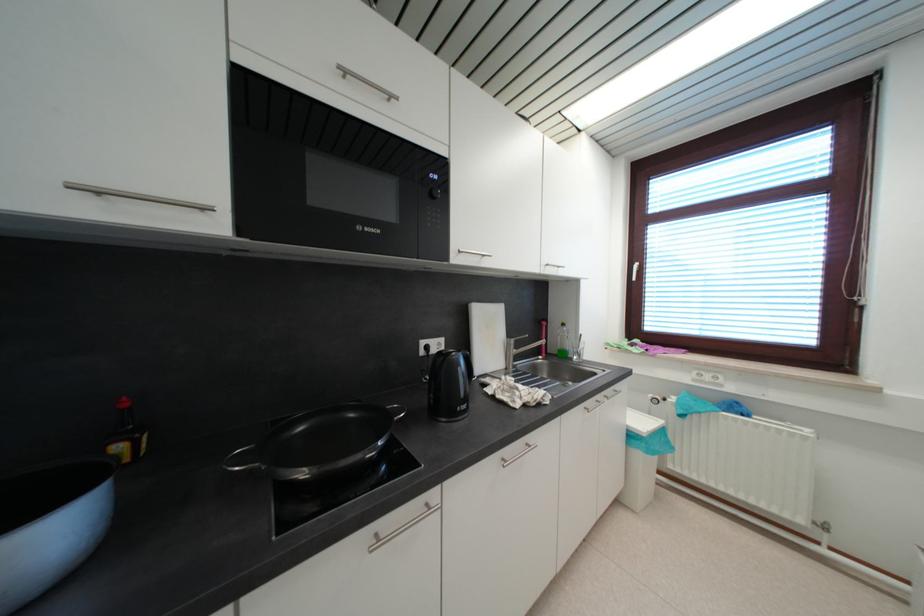
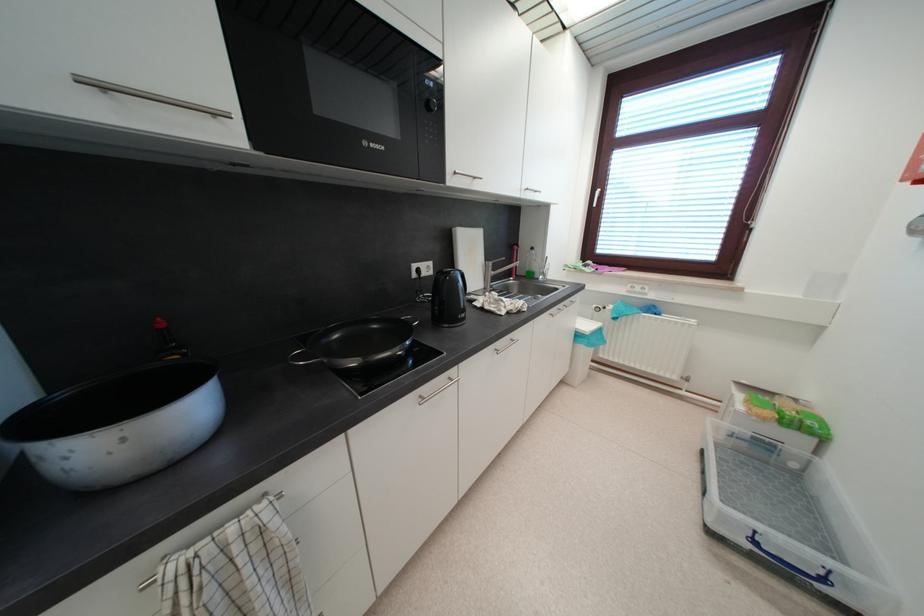
Where in the second image is the point corresponding to (507,462) from the first image?

(502, 352)